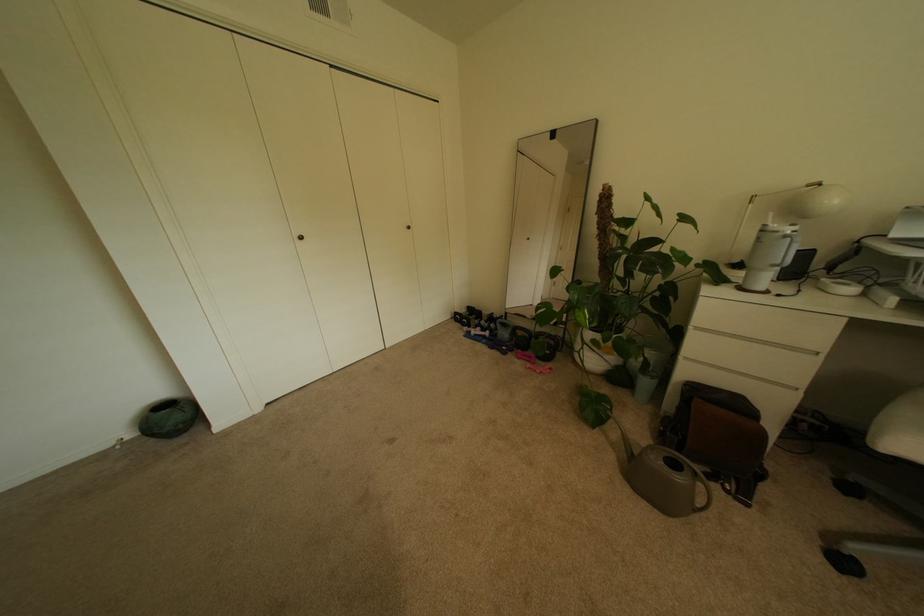
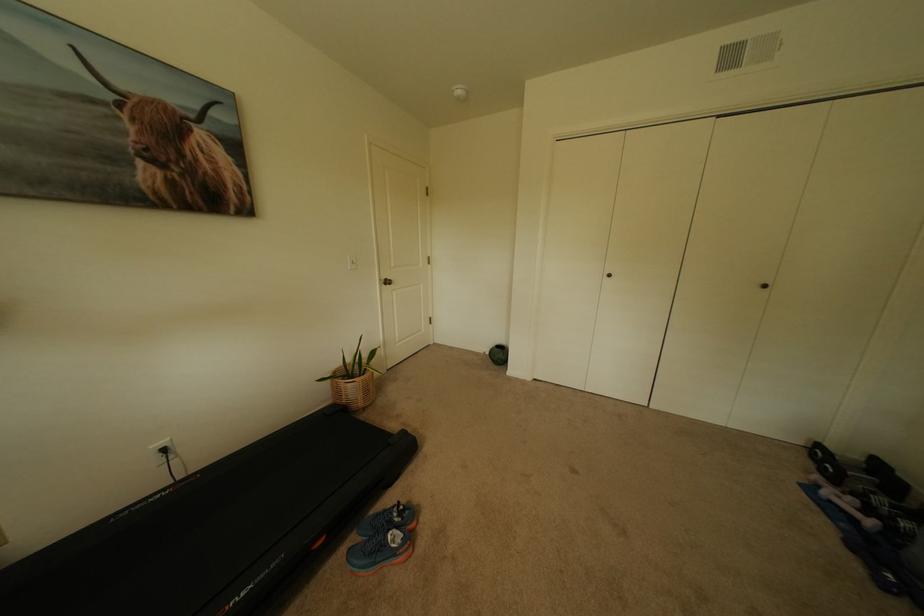
Where in the second image is the point corresponding to [492,338] from the first image?

(862, 521)